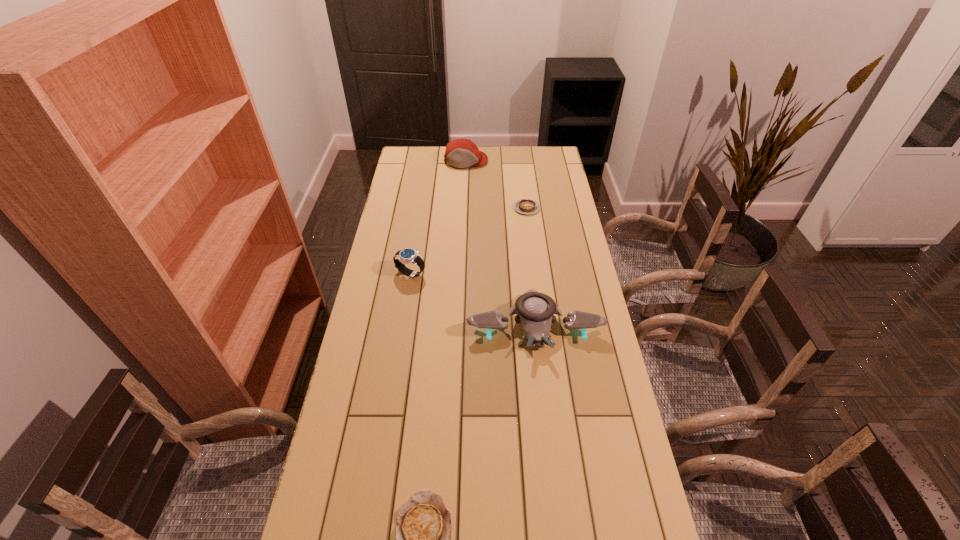
Where is `object present at the left edge`? object present at the left edge is located at coordinates (408, 255).

Where is `drone that is at the right edge`? Image resolution: width=960 pixels, height=540 pixels. drone that is at the right edge is located at coordinates (535, 311).

The width and height of the screenshot is (960, 540). What are the coordinates of `quiche situated at the right edge` in the screenshot? It's located at (x=525, y=206).

Find the location of `free space at the far edge`. free space at the far edge is located at coordinates (505, 170).

In the image, there is a desktop. In order to click on vacant space at the left edge in this screenshot , I will do `click(378, 359)`.

In the image, there is a desktop. Where is `blank space at the right edge`? Image resolution: width=960 pixels, height=540 pixels. blank space at the right edge is located at coordinates (571, 273).

Image resolution: width=960 pixels, height=540 pixels. In order to click on vacant point located between the fourth farthest object and the watch in this screenshot , I will do `click(472, 300)`.

You are a GUI agent. You are given a task and a screenshot of the screen. Output one action in this format:
    pyautogui.click(x=<x>, y=<y>)
    Task: Click on the vacant area that lies between the farthest object and the fourth farthest object
    
    Given the screenshot: What is the action you would take?
    pyautogui.click(x=500, y=244)

Image resolution: width=960 pixels, height=540 pixels. In order to click on free spot between the watch and the fourth farthest object in this screenshot , I will do `click(472, 300)`.

Locate an element on the screen. The width and height of the screenshot is (960, 540). vacant space that is in between the cap and the farther quiche is located at coordinates (496, 185).